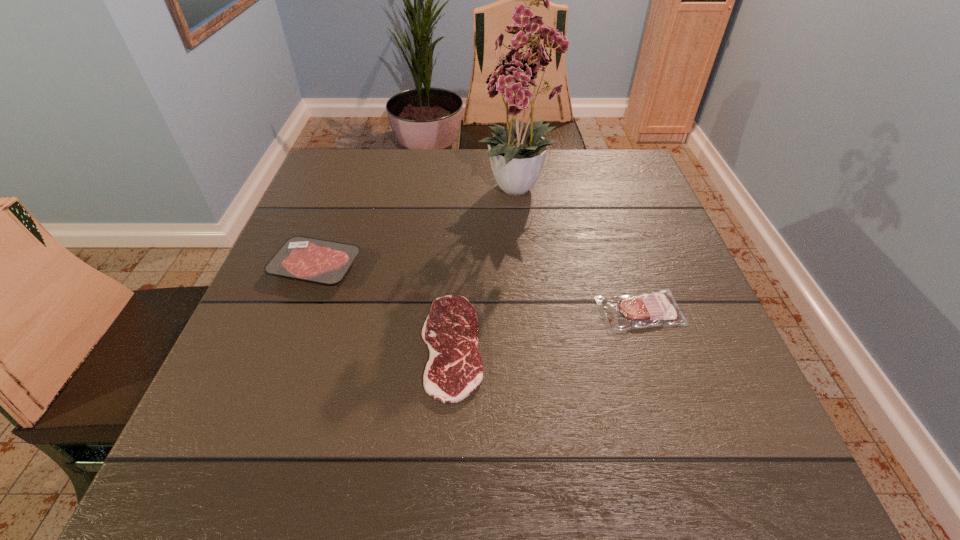
Find the location of `free space located 0.130m on the back of the second tallest steak`. free space located 0.130m on the back of the second tallest steak is located at coordinates (619, 248).

Find the location of a particular element. blank space located on the left of the shortest object is located at coordinates (348, 346).

Where is `object located at the far edge`? This screenshot has height=540, width=960. object located at the far edge is located at coordinates (515, 155).

Identify the location of object that is at the left edge. [x=314, y=260].

The width and height of the screenshot is (960, 540). Find the location of `object that is at the right edge`. object that is at the right edge is located at coordinates (657, 308).

The image size is (960, 540). Find the location of `blank space at the far edge of the desktop`. blank space at the far edge of the desktop is located at coordinates (477, 197).

The height and width of the screenshot is (540, 960). In the image, there is a desktop. In order to click on blank space at the near edge in this screenshot , I will do `click(550, 437)`.

Image resolution: width=960 pixels, height=540 pixels. Find the location of `vacant space at the left edge`. vacant space at the left edge is located at coordinates (334, 204).

The width and height of the screenshot is (960, 540). In the image, there is a desktop. Identify the location of free space at the right edge. (684, 413).

At what (x,y) coordinates should I click in order to perform the action: click on free spot at the far left corner of the desktop. Please return your answer as a coordinate pair (x, y). The width and height of the screenshot is (960, 540). Looking at the image, I should click on (359, 176).